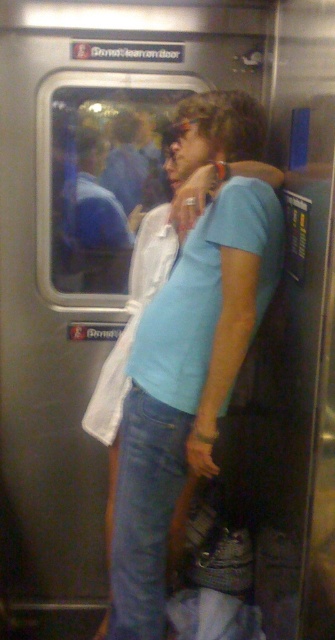
Is light blue t-shirt at center further to camera compared to blue shirt at center?

That is False.

Between point (201, 356) and point (90, 266), which one is positioned in front?

Positioned in front is point (201, 356).

The image size is (335, 640). In order to click on light blue t-shirt at center in this screenshot , I will do `click(185, 387)`.